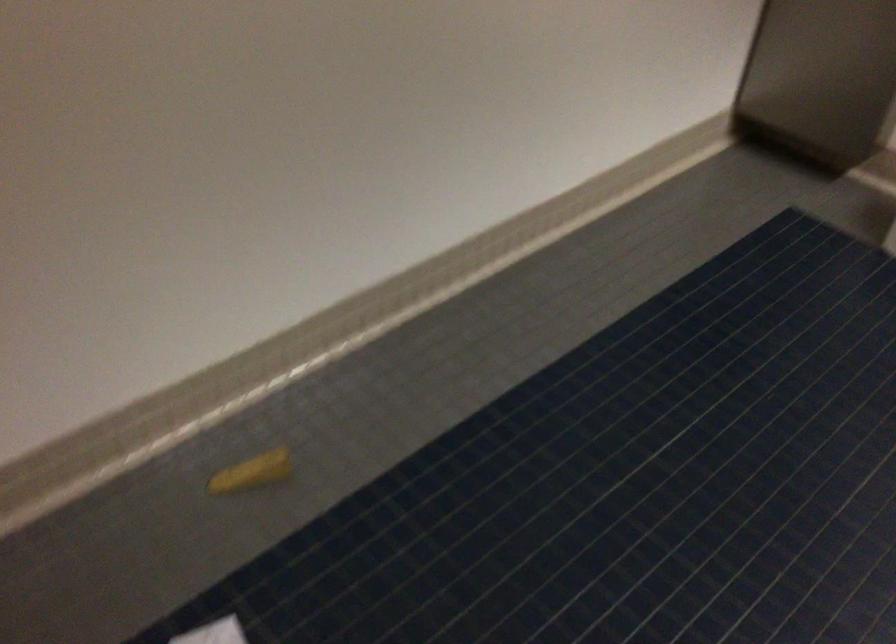
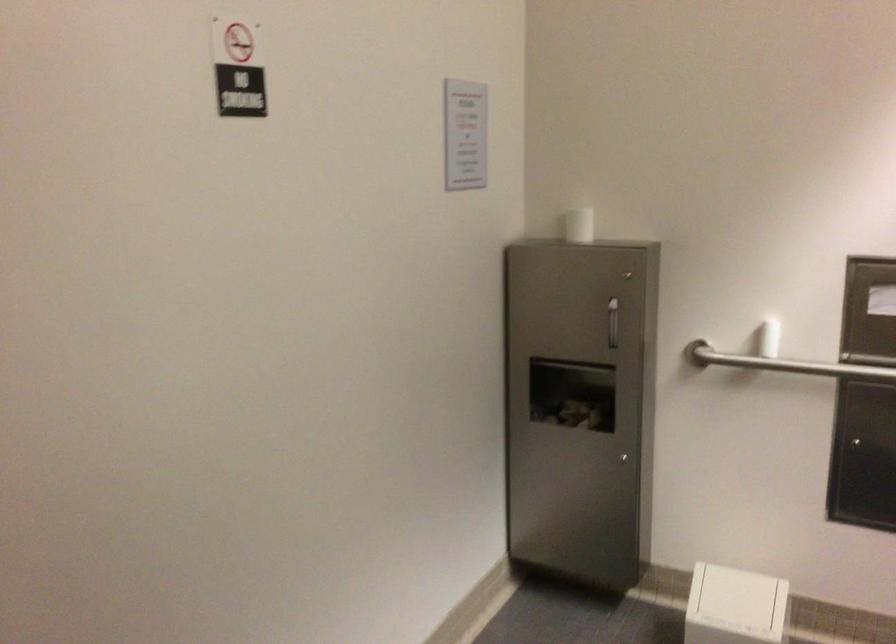
The first image is from the beginning of the video and the second image is from the end. How did the camera likely rotate when shooting the video?

The camera's rotation is toward right-up.